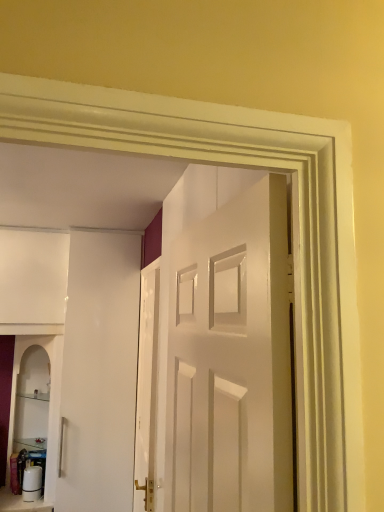
The image size is (384, 512). Identify the location of white glossy cabinet at lower left. (49, 405).

Describe the element at coordinates (147, 389) in the screenshot. I see `white glossy door at center, positioned as the 2th door in front-to-back order` at that location.

Measure the distance between white glossy door at center, the 1th door viewed from the left, and camera.

The depth of white glossy door at center, the 1th door viewed from the left, is 7.93 feet.

Locate an element on the screen. white glossy door at center, positioned as the second door in left-to-right order is located at coordinates (229, 351).

Where is `white glossy water bottle at lower left`? white glossy water bottle at lower left is located at coordinates coord(21,503).

The image size is (384, 512). In order to click on furniture below the white glossy door at center, which appears as the 1th door when viewed from the back (from a real-world perspective) in this screenshot , I will do `click(21, 503)`.

Does white glossy door at center, positioned as the 2th door in front-to-back order, have a smaller size compared to white glossy water bottle at lower left?

Incorrect, white glossy door at center, positioned as the 2th door in front-to-back order, is not smaller in size than white glossy water bottle at lower left.

From the image's perspective, which is above, white glossy door at center, positioned as the 2th door in front-to-back order, or white glossy water bottle at lower left?

white glossy door at center, positioned as the 2th door in front-to-back order, appears higher in the image.

From the picture: Is white glossy door at center, the 1th door viewed from the left, at the left side of white glossy water bottle at lower left?

No.

Does point (179, 466) come behind point (141, 333)?

No, it is not.

Does white glossy door at center, positioned as the second door in left-to-right order, have a larger size compared to white glossy door at center, which appears as the 1th door when viewed from the back?

Yes.

Measure the distance between white glossy door at center, positioned as the first door in right-to-left order, and white glossy door at center, the 1th door viewed from the left.

4.89 feet.

How many degrees apart are the facing directions of white glossy door at center, which is the 1th door from front to back, and white glossy door at center, acting as the 2th door starting from the right?

1.11 degrees.

From a real-world perspective, does white glossy door at center, positioned as the first door in right-to-left order, stand above white glossy cabinet at lower left?

Correct, in the physical world, white glossy door at center, positioned as the first door in right-to-left order, is higher than white glossy cabinet at lower left.

The image size is (384, 512). Identify the location of cabinetry that appears on the left of white glossy door at center, the second door in the back-to-front sequence. (49, 405).

Is point (182, 307) less distant than point (23, 344)?

Yes, it is.

Based on the photo, which of these two, white glossy door at center, which is the 1th door from front to back, or white glossy cabinet at lower left, is wider?

Wider between the two is white glossy cabinet at lower left.

Is white glossy water bottle at lower left taller than white glossy door at center, the second door in the back-to-front sequence?

No, white glossy water bottle at lower left is not taller than white glossy door at center, the second door in the back-to-front sequence.

From a real-world perspective, who is located higher, white glossy water bottle at lower left or white glossy door at center, positioned as the first door in right-to-left order?

white glossy door at center, positioned as the first door in right-to-left order, from a real-world perspective.

Locate an element on the screen. The width and height of the screenshot is (384, 512). the 2nd door to the right of the white glossy water bottle at lower left, counting from the anchor's position is located at coordinates (229, 351).

Is white glossy water bottle at lower left oriented towards white glossy door at center, positioned as the first door in right-to-left order?

No, white glossy water bottle at lower left is not oriented towards white glossy door at center, positioned as the first door in right-to-left order.

This screenshot has height=512, width=384. In order to click on door located below the white glossy door at center, positioned as the first door in right-to-left order (from the image's perspective) in this screenshot , I will do `click(147, 389)`.

Is white glossy door at center, acting as the 2th door starting from the right, placed right next to white glossy door at center, positioned as the second door in left-to-right order?

They are not placed beside each other.

Which of these two, white glossy door at center, the 1th door viewed from the left, or white glossy door at center, positioned as the second door in left-to-right order, is wider?

Wider between the two is white glossy door at center, positioned as the second door in left-to-right order.

From a real-world perspective, which is physically below, white glossy cabinet at lower left or white glossy door at center, positioned as the first door in right-to-left order?

white glossy cabinet at lower left, from a real-world perspective.

Which of these two, white glossy cabinet at lower left or white glossy door at center, positioned as the second door in left-to-right order, is smaller?

With smaller size is white glossy cabinet at lower left.

How far apart are white glossy water bottle at lower left and white glossy door at center, acting as the 2th door starting from the right?

white glossy water bottle at lower left and white glossy door at center, acting as the 2th door starting from the right, are 91.88 centimeters apart from each other.

The height and width of the screenshot is (512, 384). I want to click on furniture below the white glossy door at center, which appears as the 1th door when viewed from the back (from the image's perspective), so click(x=21, y=503).

Can you confirm if white glossy water bottle at lower left is taller than white glossy door at center, positioned as the 2th door in front-to-back order?

No.

From a real-world perspective, is white glossy water bottle at lower left positioned above or below white glossy door at center, which appears as the 1th door when viewed from the back?

white glossy water bottle at lower left is below white glossy door at center, which appears as the 1th door when viewed from the back.

At what (x,y) coordinates should I click in order to perform the action: click on furniture directly beneath the white glossy door at center, positioned as the 2th door in front-to-back order (from a real-world perspective). Please return your answer as a coordinate pair (x, y). Looking at the image, I should click on (21, 503).

What are the coordinates of `door on the left of the white glossy door at center, the second door in the back-to-front sequence` in the screenshot? It's located at (147, 389).

Based on their spatial positions, is white glossy water bottle at lower left or white glossy cabinet at lower left further from white glossy door at center, positioned as the first door in right-to-left order?

white glossy water bottle at lower left is further to white glossy door at center, positioned as the first door in right-to-left order.

From the image, which object appears to be nearer to white glossy door at center, positioned as the first door in right-to-left order, white glossy cabinet at lower left or white glossy water bottle at lower left?

white glossy cabinet at lower left is closer to white glossy door at center, positioned as the first door in right-to-left order.

Estimate the real-world distances between objects in this image. Which object is further from white glossy door at center, positioned as the first door in right-to-left order, white glossy cabinet at lower left or white glossy door at center, acting as the 2th door starting from the right?

white glossy cabinet at lower left.

From the image, which object appears to be farther from white glossy water bottle at lower left, white glossy cabinet at lower left or white glossy door at center, positioned as the second door in left-to-right order?

white glossy door at center, positioned as the second door in left-to-right order, lies further to white glossy water bottle at lower left than the other object.

Looking at the image, which one is located closer to white glossy door at center, which appears as the 1th door when viewed from the back, white glossy water bottle at lower left or white glossy door at center, positioned as the first door in right-to-left order?

white glossy water bottle at lower left is positioned closer to the anchor white glossy door at center, which appears as the 1th door when viewed from the back.

Estimate the real-world distances between objects in this image. Which object is closer to white glossy door at center, acting as the 2th door starting from the right, white glossy cabinet at lower left or white glossy water bottle at lower left?

white glossy cabinet at lower left is closer to white glossy door at center, acting as the 2th door starting from the right.

Considering their positions, is white glossy cabinet at lower left positioned further to white glossy water bottle at lower left than white glossy door at center, the 1th door viewed from the left?

white glossy door at center, the 1th door viewed from the left, lies further to white glossy water bottle at lower left than the other object.

In the scene shown: From the image, which object appears to be nearer to white glossy water bottle at lower left, white glossy door at center, the second door in the back-to-front sequence, or white glossy door at center, which appears as the 1th door when viewed from the back?

Based on the image, white glossy door at center, which appears as the 1th door when viewed from the back, appears to be nearer to white glossy water bottle at lower left.

Identify the location of cabinetry situated between white glossy water bottle at lower left and white glossy door at center, positioned as the 2th door in front-to-back order, from left to right. coord(49,405).

I want to click on door located between white glossy door at center, positioned as the second door in left-to-right order, and white glossy water bottle at lower left in the depth direction, so click(x=147, y=389).

The height and width of the screenshot is (512, 384). In order to click on door between white glossy door at center, the second door in the back-to-front sequence, and white glossy cabinet at lower left, along the z-axis in this screenshot , I will do `click(147, 389)`.

Where is `furniture between white glossy door at center, the second door in the back-to-front sequence, and white glossy cabinet at lower left from front to back`? This screenshot has width=384, height=512. furniture between white glossy door at center, the second door in the back-to-front sequence, and white glossy cabinet at lower left from front to back is located at coordinates (21, 503).